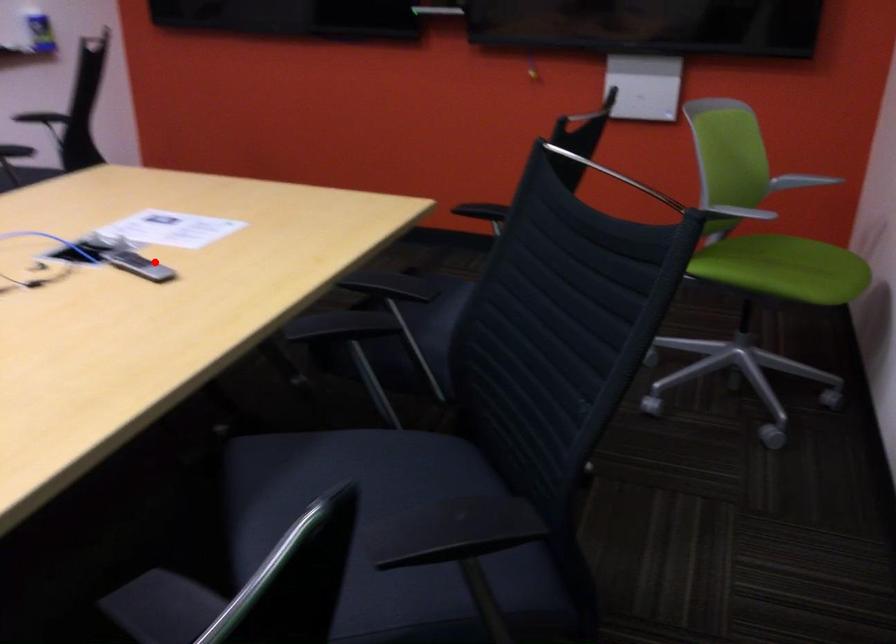
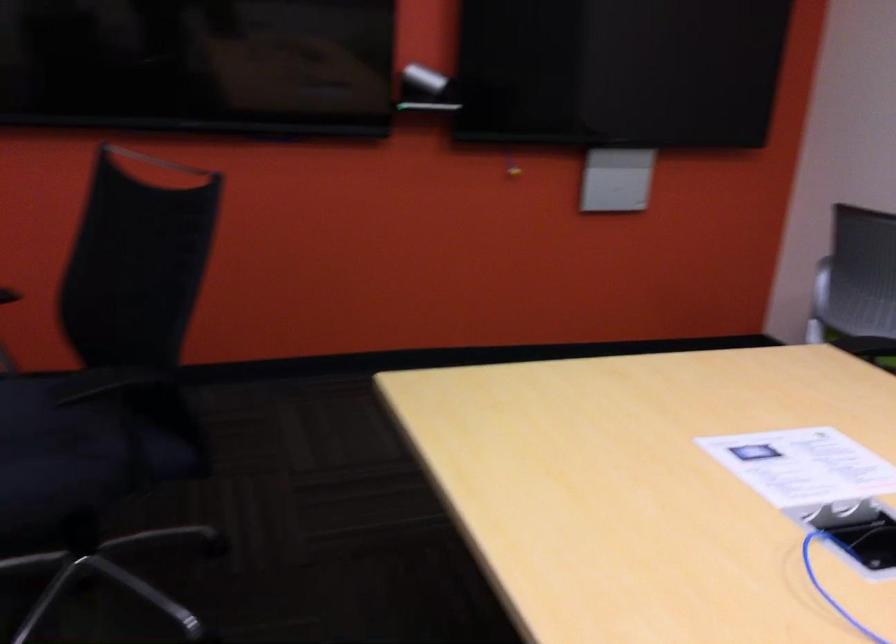
Question: A red point is marked in image1. In image2, is the corresponding 3D point closer to the camera or farther? Reply with the corresponding letter.

Choices:
 (A) The corresponding 3D point is closer.
 (B) The corresponding 3D point is farther.

Answer: (A)